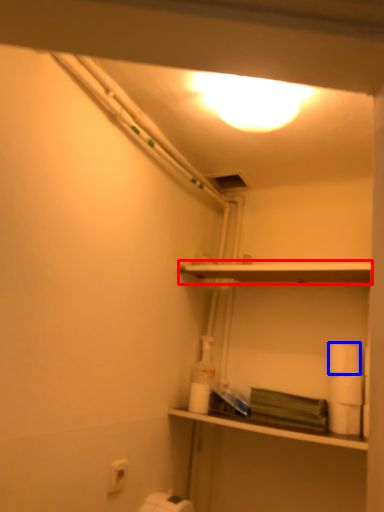
Question: Which object is closer to the camera taking this photo, shelf (highlighted by a red box) or toilet paper (highlighted by a blue box)?

Choices:
 (A) shelf
 (B) toilet paper

Answer: (A)